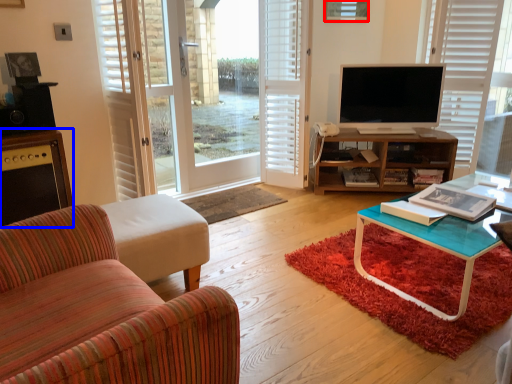
Question: Which object is further to the camera taking this photo, picture frame (highlighted by a red box) or cabinetry (highlighted by a blue box)?

Choices:
 (A) picture frame
 (B) cabinetry

Answer: (A)